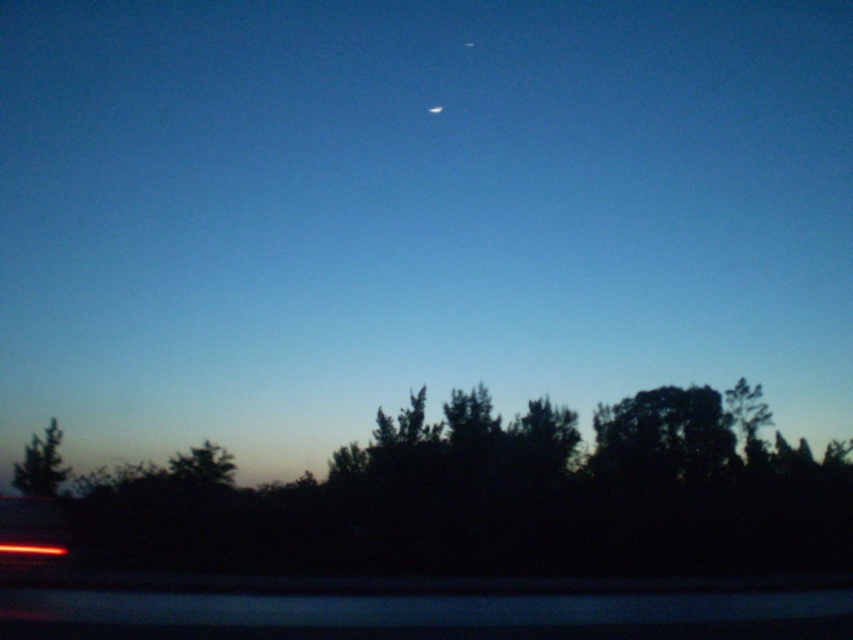
Does green matte tree at lower left appear on the left side of white glossy moon at upper center?

Yes, green matte tree at lower left is to the left of white glossy moon at upper center.

Between green matte tree at lower left and white glossy moon at upper center, which one appears on the left side from the viewer's perspective?

From the viewer's perspective, green matte tree at lower left appears more on the left side.

At what (x,y) coordinates should I click in order to perform the action: click on green matte tree at lower left. Please return your answer as a coordinate pair (x, y). This screenshot has width=853, height=640. Looking at the image, I should click on (41, 465).

Is point (418, 496) closer to camera compared to point (61, 440)?

Yes, it is in front of point (61, 440).

Between silhouette leafy tree at lower center and green matte tree at lower left, which one is positioned lower?

green matte tree at lower left is lower down.

Is point (602, 420) farther from viewer compared to point (38, 456)?

Yes, point (602, 420) is farther from viewer.

At what (x,y) coordinates should I click in order to perform the action: click on silhouette leafy tree at lower center. Please return your answer as a coordinate pair (x, y). Image resolution: width=853 pixels, height=640 pixels. Looking at the image, I should click on (494, 499).

Does silhouette leafy tree at lower center appear under white glossy moon at upper center?

Correct, silhouette leafy tree at lower center is located below white glossy moon at upper center.

Where is `silhouette leafy tree at lower center`? The width and height of the screenshot is (853, 640). silhouette leafy tree at lower center is located at coordinates (494, 499).